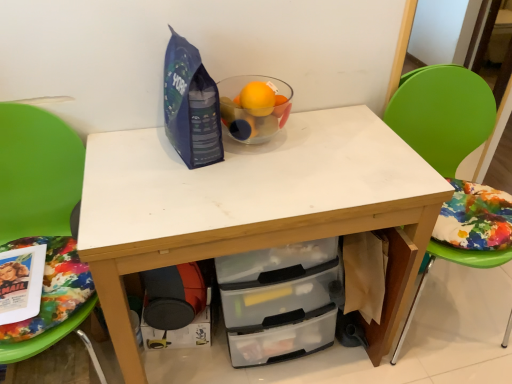
Where is `free spot above white matte table at center (from a real-world perspective)`? This screenshot has height=384, width=512. free spot above white matte table at center (from a real-world perspective) is located at coordinates (253, 166).